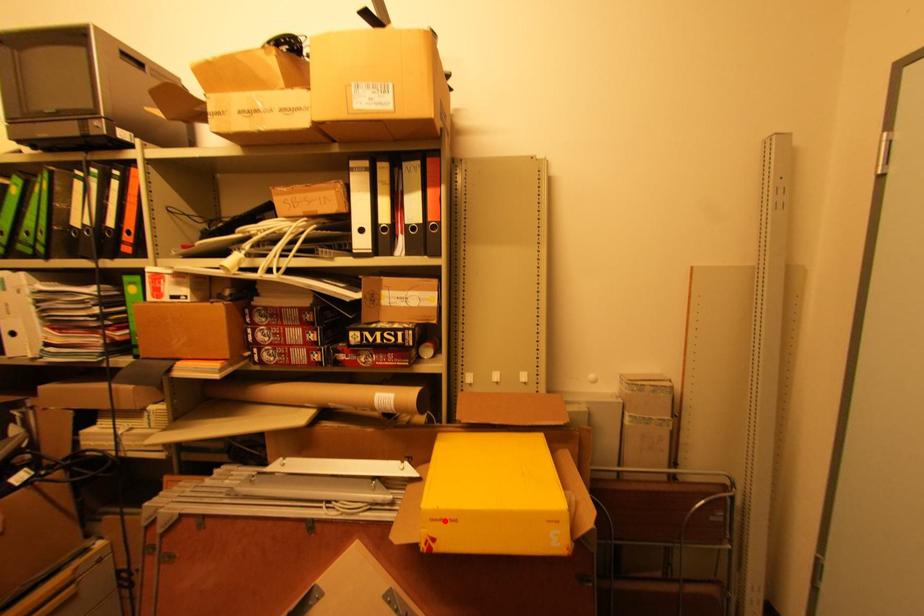
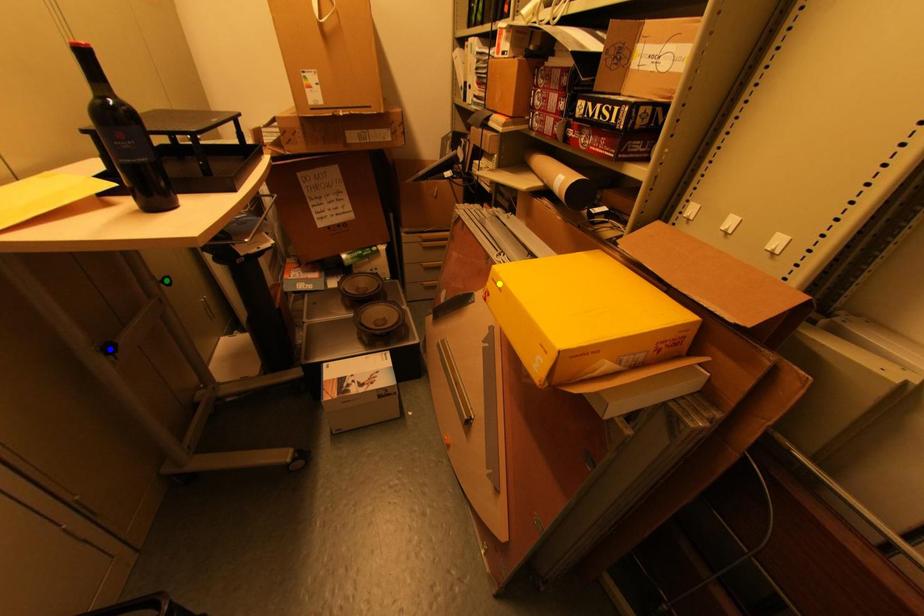
Question: I am providing you with two images of the same scene from different viewpoints. A red point is marked on the first image. You are given multiple points on the second image. Which spot in image 2 lines up with the point in image 1?

Choices:
 (A) yellow point
 (B) green point
 (C) blue point

Answer: (A)